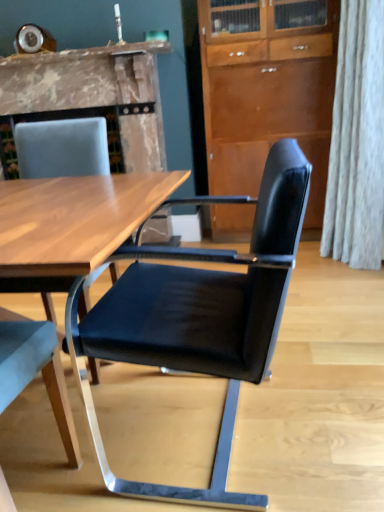
Question: Can you confirm if marble fireplace at upper left is positioned to the right of black leather chair at center, which is the second chair in left-to-right order?

Choices:
 (A) no
 (B) yes

Answer: (A)

Question: Does marble fireplace at upper left have a greater width compared to black leather chair at center, which is the second chair in left-to-right order?

Choices:
 (A) yes
 (B) no

Answer: (A)

Question: Is marble fireplace at upper left facing towards black leather chair at center, the first chair viewed from the right?

Choices:
 (A) no
 (B) yes

Answer: (B)

Question: From a real-world perspective, is marble fireplace at upper left on top of black leather chair at center, the first chair viewed from the right?

Choices:
 (A) yes
 (B) no

Answer: (A)

Question: Is marble fireplace at upper left placed right next to black leather chair at center, which is the second chair in left-to-right order?

Choices:
 (A) no
 (B) yes

Answer: (A)

Question: Is marble fireplace at upper left bigger or smaller than black leather chair at center, the first chair viewed from the right?

Choices:
 (A) small
 (B) big

Answer: (B)

Question: From a real-world perspective, is marble fireplace at upper left physically located above or below black leather chair at center, which is the second chair in left-to-right order?

Choices:
 (A) above
 (B) below

Answer: (A)

Question: Considering the positions of point pos(44,96) and point pos(220,346), is point pos(44,96) closer or farther from the camera than point pos(220,346)?

Choices:
 (A) farther
 (B) closer

Answer: (A)

Question: Is marble fireplace at upper left inside or outside of black leather chair at center, which is the second chair in left-to-right order?

Choices:
 (A) inside
 (B) outside

Answer: (B)

Question: From a real-world perspective, is wooden cabinet at center positioned above or below marble fireplace at upper left?

Choices:
 (A) above
 (B) below

Answer: (B)

Question: Is wooden cabinet at center inside or outside of marble fireplace at upper left?

Choices:
 (A) outside
 (B) inside

Answer: (A)

Question: Considering the positions of point [309, 138] and point [137, 110], is point [309, 138] closer or farther from the camera than point [137, 110]?

Choices:
 (A) farther
 (B) closer

Answer: (B)

Question: Relative to marble fireplace at upper left, is wooden cabinet at center in front or behind?

Choices:
 (A) front
 (B) behind

Answer: (A)

Question: From the image's perspective, is black leather chair at center, which is the second chair in left-to-right order, located above or below marble fireplace at upper left?

Choices:
 (A) below
 (B) above

Answer: (A)

Question: Considering the positions of black leather chair at center, which is the second chair in left-to-right order, and marble fireplace at upper left in the image, is black leather chair at center, which is the second chair in left-to-right order, bigger or smaller than marble fireplace at upper left?

Choices:
 (A) big
 (B) small

Answer: (B)